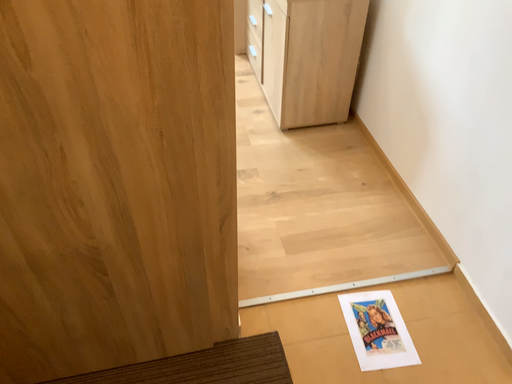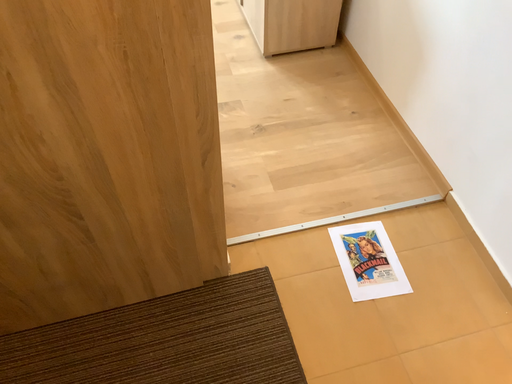
Question: How did the camera likely rotate when shooting the video?

Choices:
 (A) rotated downward
 (B) rotated upward

Answer: (A)